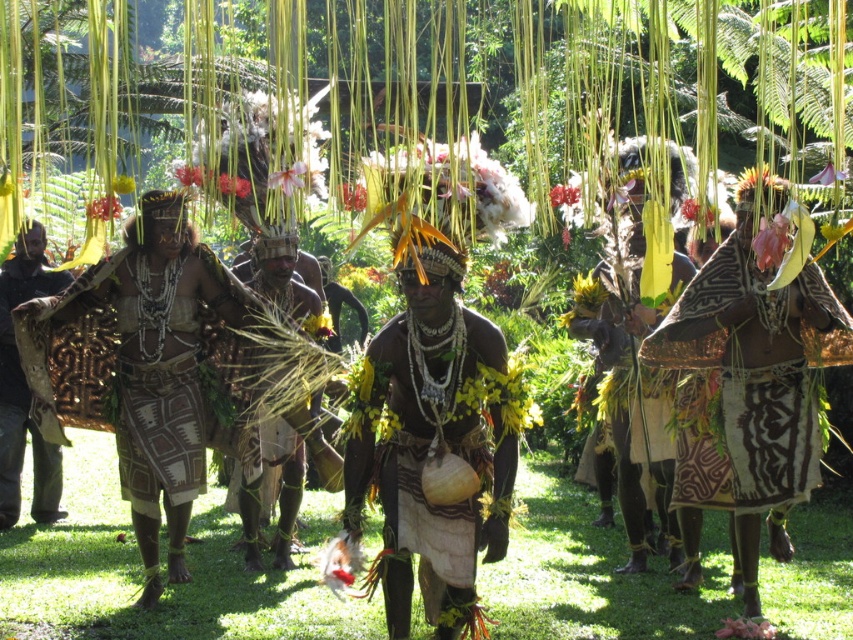
Question: Does brown woven skirt at center appear under matte black headdress at center?

Choices:
 (A) no
 (B) yes

Answer: (A)

Question: Which point is closer to the camera taking this photo?

Choices:
 (A) 19,426
 (B) 825,307
 (C) 303,284

Answer: (B)

Question: Is the position of brown woven cloth at center more distant than that of matte brown cloth at left?

Choices:
 (A) no
 (B) yes

Answer: (A)

Question: Among these objects, which one is farthest from the camera?

Choices:
 (A) brown woven skirt at center
 (B) brown woven cloth at center
 (C) matte black headdress at center

Answer: (A)

Question: Can you confirm if matte brown cloth at left is positioned below matte brown grass skirt at center?

Choices:
 (A) no
 (B) yes

Answer: (A)

Question: Which object is farther from the camera taking this photo?

Choices:
 (A) matte black headdress at center
 (B) brown woven cloth at center

Answer: (B)